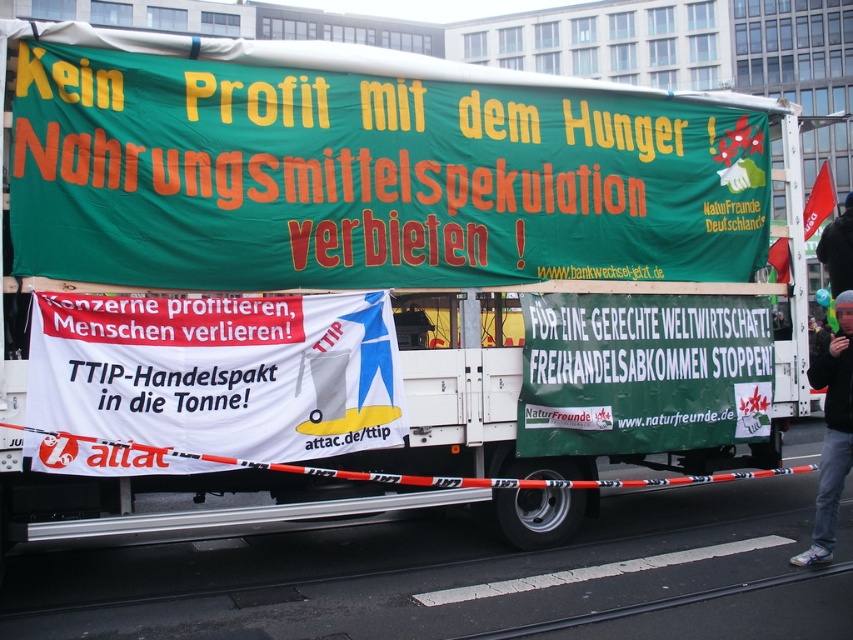
Question: Which object is positioned closest to the black jacket at lower right?

Choices:
 (A) green fabric banner at center
 (B) white paper banner at center

Answer: (A)

Question: Which point is closer to the camera taking this photo?

Choices:
 (A) (840, 451)
 (B) (558, 348)
 (C) (654, 154)
 (D) (283, 397)

Answer: (D)

Question: Can you confirm if green fabric banner at upper center is positioned to the left of white paper banner at center?

Choices:
 (A) no
 (B) yes

Answer: (A)

Question: Does green fabric banner at upper center appear over black jacket at lower right?

Choices:
 (A) no
 (B) yes

Answer: (B)

Question: Does green fabric banner at upper center lie behind green fabric banner at center?

Choices:
 (A) yes
 (B) no

Answer: (B)

Question: Which point is farther from the camera taking this photo?

Choices:
 (A) (846, 472)
 (B) (107, 461)
 (C) (427, 236)

Answer: (C)